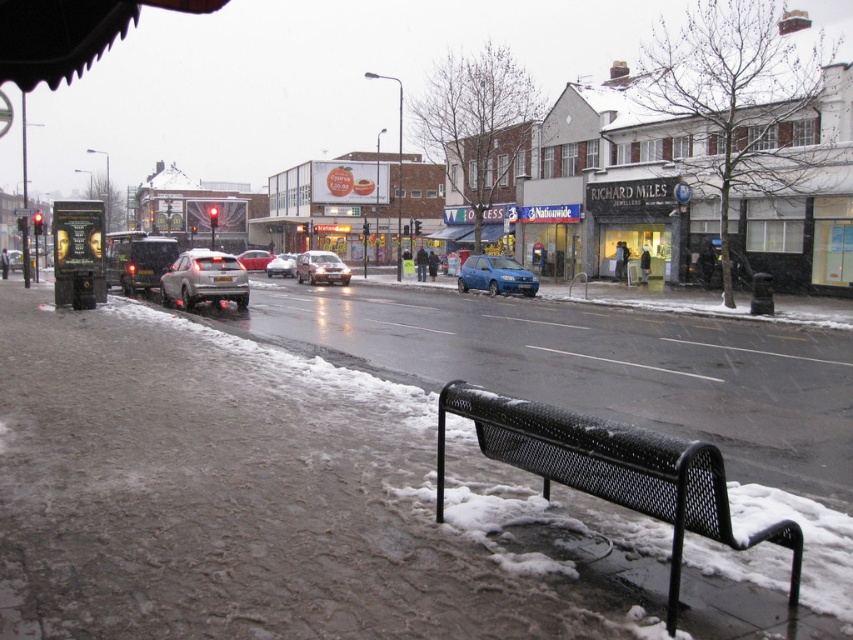
Question: Among these points, which one is farthest from the camera?

Choices:
 (A) (173, 304)
 (B) (292, 272)

Answer: (B)

Question: Is blue metallic hatchback at center positioned in front of satin silver sedan at center?

Choices:
 (A) yes
 (B) no

Answer: (A)

Question: Which of the following is the closest to the observer?

Choices:
 (A) satin silver hatchback at center
 (B) silver metallic sedan at center
 (C) satin silver sedan at center

Answer: (A)

Question: Does blue metallic hatchback at center lie in front of satin silver sedan at center?

Choices:
 (A) yes
 (B) no

Answer: (A)

Question: Can you confirm if satin silver hatchback at center is bigger than white glossy car at center?

Choices:
 (A) no
 (B) yes

Answer: (A)

Question: Which object appears farthest from the camera in this image?

Choices:
 (A) silver metallic sedan at center
 (B) satin silver hatchback at center
 (C) blue metallic hatchback at center

Answer: (A)